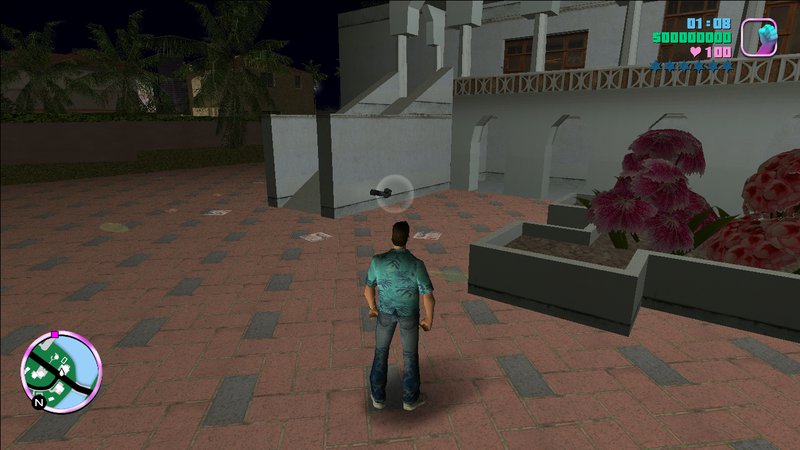
I want to click on middle archway, so click(554, 154).